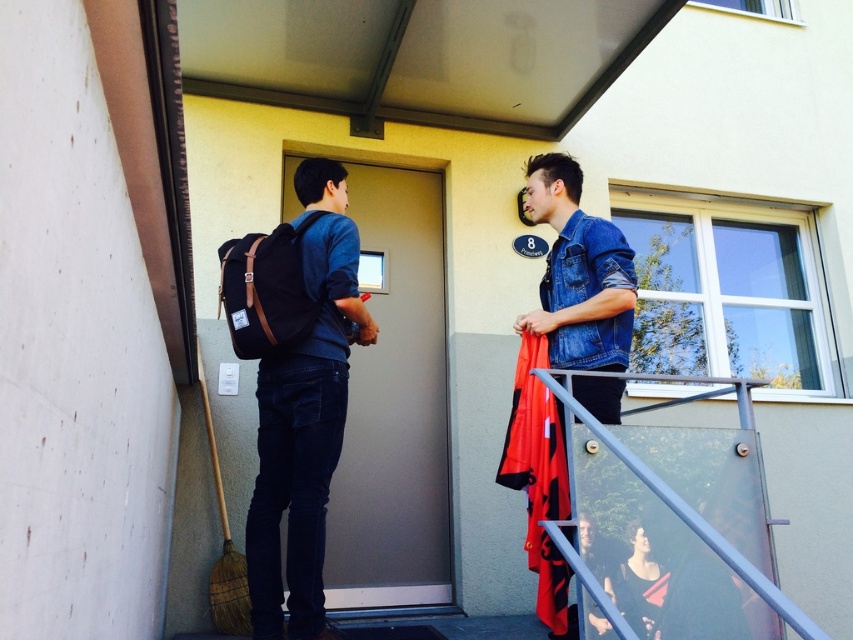
Does matte black backpack at left have a lesser height compared to denim jacket at upper right?

In fact, matte black backpack at left may be taller than denim jacket at upper right.

Who is positioned more to the left, matte black backpack at left or denim jacket at upper right?

Positioned to the left is matte black backpack at left.

Between point (305, 573) and point (608, 356), which one is positioned in front?

Positioned in front is point (305, 573).

Find the location of `matte black backpack at left`. matte black backpack at left is located at coordinates (305, 416).